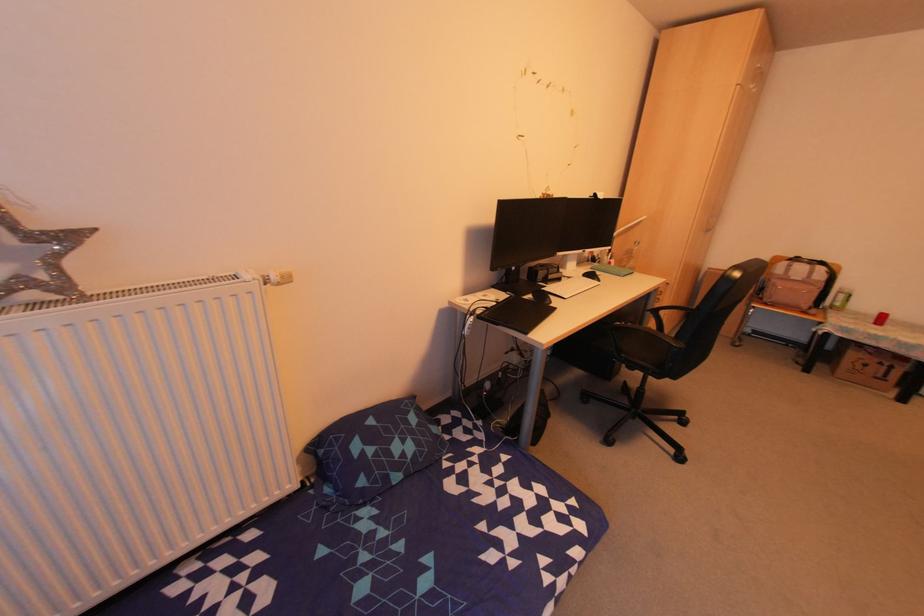
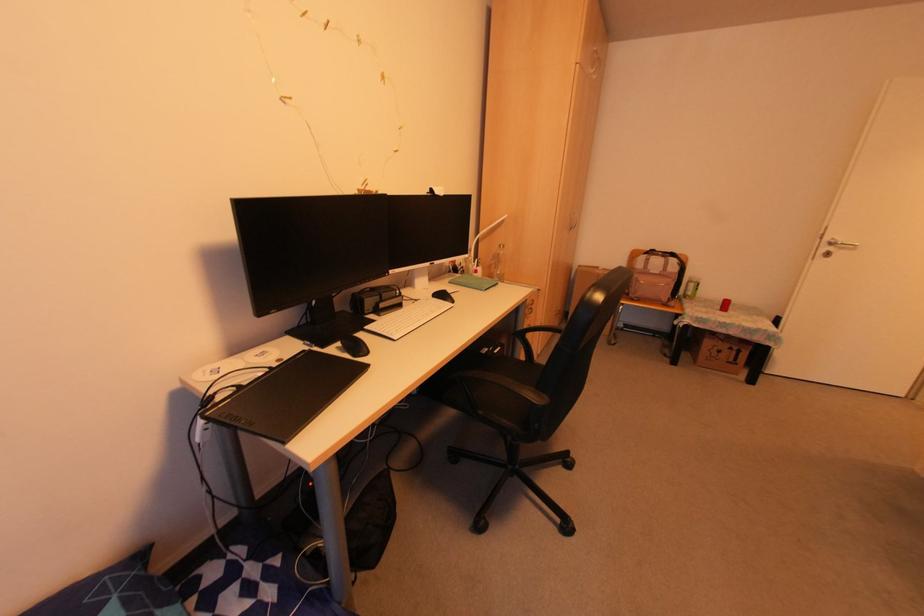
Where in the second image is the point corresponding to the point at 830,306 from the first image?

(683, 296)